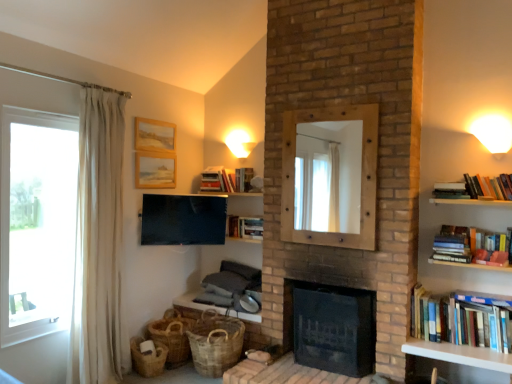
Question: Is white sheer curtain at left behind brown woven basket at lower left, marked as the 3th basket in a right-to-left arrangement?

Choices:
 (A) yes
 (B) no

Answer: (B)

Question: From a real-world perspective, is white sheer curtain at left below brown woven basket at lower left, placed as the 1th basket when sorted from left to right?

Choices:
 (A) no
 (B) yes

Answer: (A)

Question: Does white sheer curtain at left have a larger size compared to brown woven basket at lower left, marked as the 3th basket in a right-to-left arrangement?

Choices:
 (A) no
 (B) yes

Answer: (B)

Question: Can you confirm if white sheer curtain at left is taller than brown woven basket at lower left, placed as the 1th basket when sorted from left to right?

Choices:
 (A) yes
 (B) no

Answer: (A)

Question: Does white sheer curtain at left have a lesser width compared to brown woven basket at lower left, placed as the 1th basket when sorted from left to right?

Choices:
 (A) yes
 (B) no

Answer: (A)

Question: Is wooden mirror at center, arranged as the first fireplace when viewed from the top, spatially inside woven brown basket at lower left, which appears as the 2th basket when viewed from the right, or outside of it?

Choices:
 (A) outside
 (B) inside

Answer: (A)

Question: Is point (292, 129) closer or farther from the camera than point (153, 334)?

Choices:
 (A) closer
 (B) farther

Answer: (A)

Question: From the image's perspective, is wooden mirror at center, the 2th fireplace from the bottom, positioned above or below woven brown basket at lower left, the 2th basket from the left?

Choices:
 (A) below
 (B) above

Answer: (B)

Question: In terms of width, does wooden mirror at center, arranged as the first fireplace when viewed from the top, look wider or thinner when compared to woven brown basket at lower left, the 2th basket from the left?

Choices:
 (A) wide
 (B) thin

Answer: (B)

Question: From the image's perspective, relative to transparent glass window at left, is wooden picture frame at upper center, the first picture frame ordered from the bottom, above or below?

Choices:
 (A) above
 (B) below

Answer: (A)

Question: Based on their sizes in the image, would you say wooden picture frame at upper center, the first picture frame ordered from the bottom, is bigger or smaller than transparent glass window at left?

Choices:
 (A) big
 (B) small

Answer: (B)

Question: Is wooden picture frame at upper center, acting as the second picture frame starting from the top, situated inside transparent glass window at left or outside?

Choices:
 (A) inside
 (B) outside

Answer: (B)

Question: From a real-world perspective, relative to transparent glass window at left, is wooden picture frame at upper center, the first picture frame ordered from the bottom, vertically above or below?

Choices:
 (A) above
 (B) below

Answer: (A)

Question: Would you say hardcover book at upper center, positioned as the fourth book in right-to-left order, is inside or outside wooden picture frame at upper center, the first picture frame ordered from the bottom?

Choices:
 (A) inside
 (B) outside

Answer: (B)

Question: From the image's perspective, is hardcover book at upper center, acting as the fourth book starting from the top, above or below wooden picture frame at upper center, the first picture frame ordered from the bottom?

Choices:
 (A) below
 (B) above

Answer: (A)